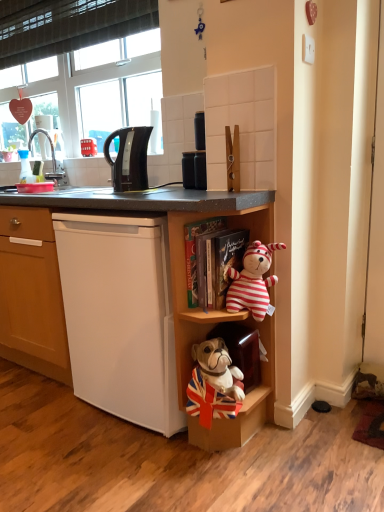
Question: Considering the positions of red plastic phone at upper left and matte black canister at upper center in the image, is red plastic phone at upper left taller or shorter than matte black canister at upper center?

Choices:
 (A) tall
 (B) short

Answer: (B)

Question: From a real-world perspective, is red plastic phone at upper left positioned above or below matte black canister at upper center?

Choices:
 (A) below
 (B) above

Answer: (B)

Question: Estimate the real-world distances between objects in this image. Which object is closer to the velvet-like brown cabinet at lower center, the second cabinet positioned from the left?

Choices:
 (A) transparent plastic bottle at left
 (B) matte black canister at upper center
 (C) white matte cabinet at lower right, the 2th cabinet in the right-to-left sequence
 (D) striped fabric teddy bear at center, placed as the 2th shelf when sorted from bottom to top
 (E) white matte refrigerator at lower left

Answer: (D)

Question: Estimate the real-world distances between objects in this image. Which object is farther from the white matte cabinet at lower right, the 2th cabinet in the right-to-left sequence?

Choices:
 (A) white matte refrigerator at lower left
 (B) red plastic phone at upper left
 (C) velvet-like brown cabinet at lower center, the second cabinet positioned from the left
 (D) black glossy electric kettle at upper left
 (E) transparent plastic bottle at left

Answer: (B)